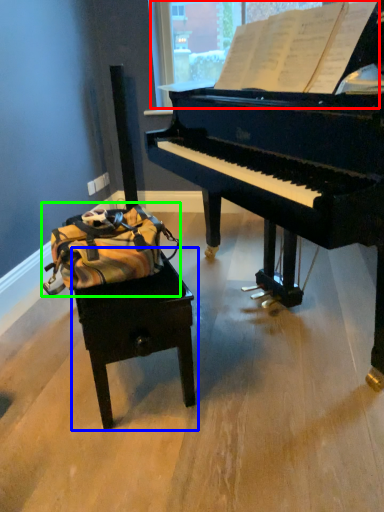
Question: Considering the real-world distances, which object is closest to window screen (highlighted by a red box)? table (highlighted by a blue box) or messenger bag (highlighted by a green box).

Choices:
 (A) table
 (B) messenger bag

Answer: (B)